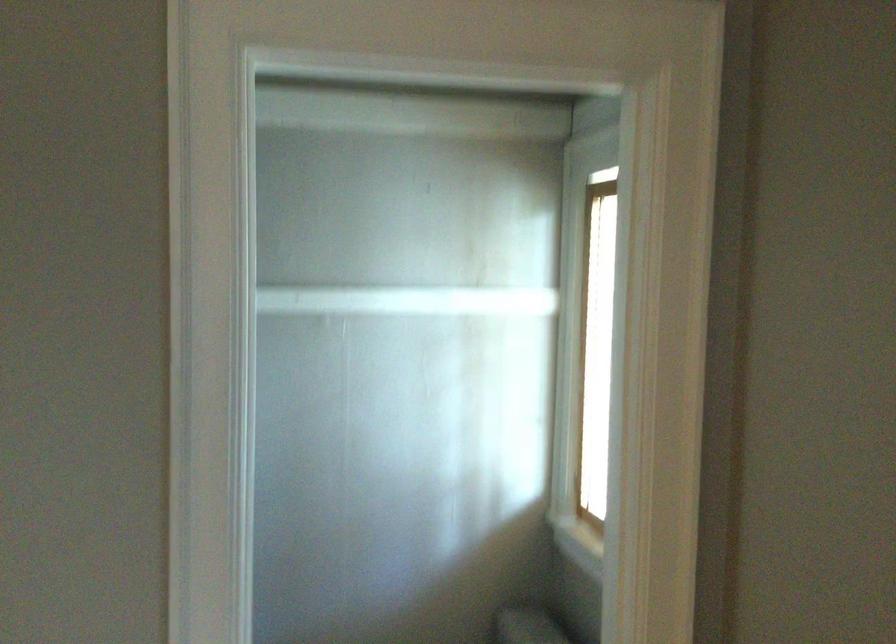
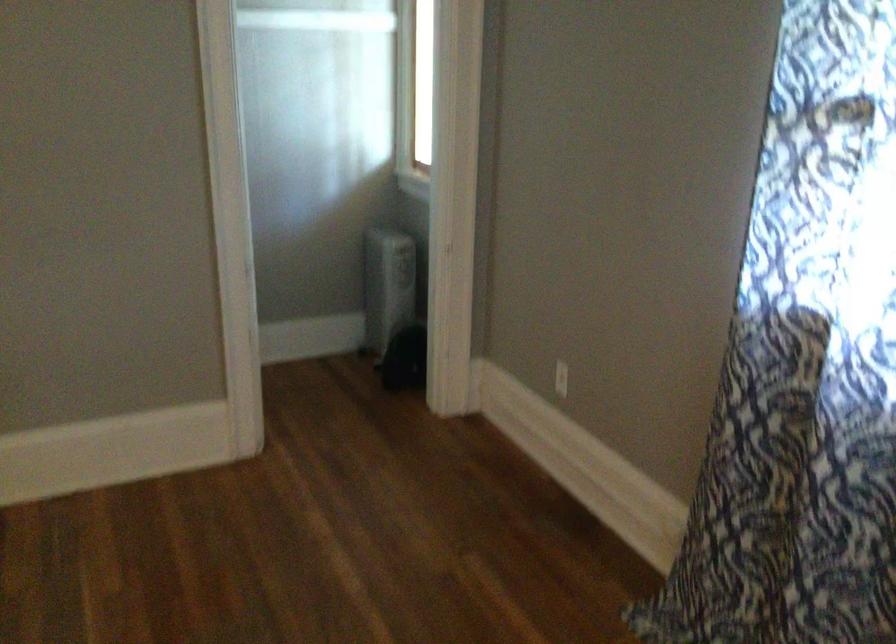
The point at (423, 290) is marked in the first image. Where is the corresponding point in the second image?

(313, 13)